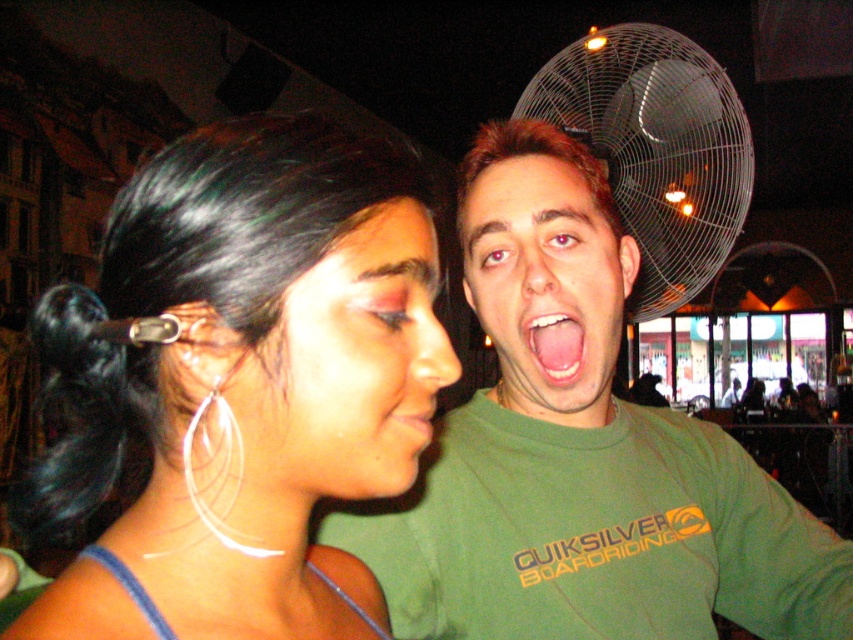
You are a makeup artist preparing for a photoshoot. You have a matte pink eye shadow at center and a green matte shirt at center in your kit. Which item do you think will require more space when packing them side by side in your case?

The green matte shirt at center requires more space because it has a greater width than the matte pink eye shadow at center.

You are standing at the origin of the coordinate system in the image. You want to move towards the point at (425, 406). Will the point at (518, 148) block your path?

Point (518, 148) is behind point (425, 406), so it will not block your path to point (425, 406).

You are a photographer using a camera with a depth of field of 30 centimeters. You want to take a photo where the matte pink eye shadow at center is in focus. Can you achieve this without adjusting your camera settings?

The matte pink eye shadow at center is 32.03 centimeters away from the camera. Since the depth of field is only 30 centimeters, the subject will be slightly out of focus. To ensure sharpness, you need to adjust the camera settings to increase the depth of field or move closer to the matte pink eye shadow at center.